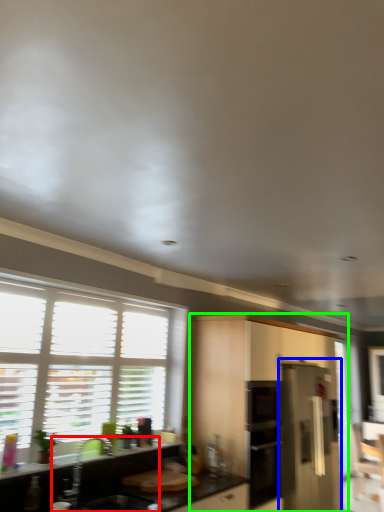
Question: Considering the real-world distances, which object is farthest from sink (highlighted by a red box)? appliance (highlighted by a blue box) or cabinetry (highlighted by a green box)?

Choices:
 (A) appliance
 (B) cabinetry

Answer: (A)